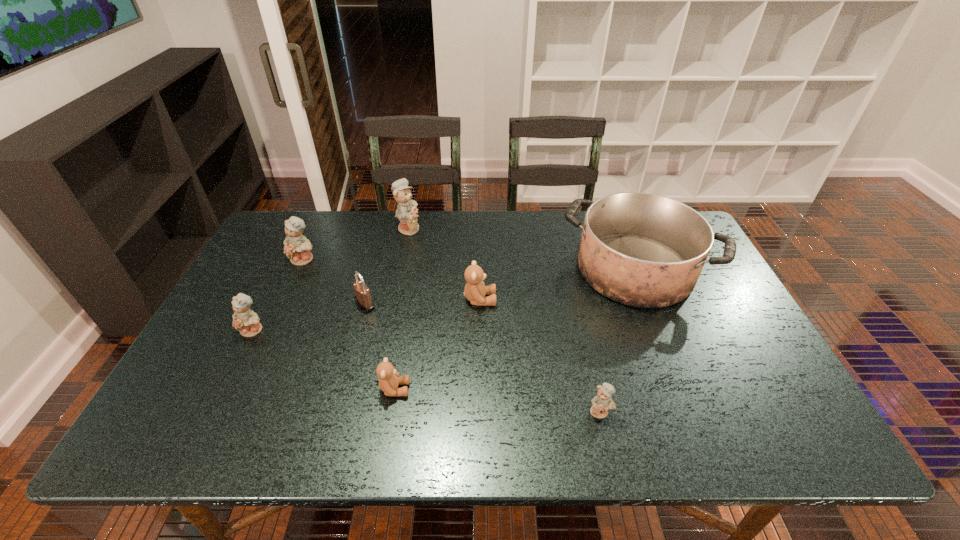
The width and height of the screenshot is (960, 540). I want to click on free space between the sixth object from right to left and the tallest teddy bear, so click(387, 266).

Where is `vacant area that lies between the fifth farthest teddy bear and the third smallest blue teddy bear`? The image size is (960, 540). vacant area that lies between the fifth farthest teddy bear and the third smallest blue teddy bear is located at coordinates (349, 325).

At what (x,y) coordinates should I click in order to perform the action: click on object that can be found as the seventh closest to the third nearest object. Please return your answer as a coordinate pair (x, y). Image resolution: width=960 pixels, height=540 pixels. Looking at the image, I should click on (601, 403).

Where is `the second closest object to the third biggest blue teddy bear`? This screenshot has width=960, height=540. the second closest object to the third biggest blue teddy bear is located at coordinates (297, 247).

This screenshot has height=540, width=960. In order to click on teddy bear that is the closest to the sixth object from right to left in this screenshot , I will do `click(297, 247)`.

Locate which teddy bear ranks fifth in proximity to the saucepan. Please provide its 2D coordinates. Your answer should be formatted as a tuple, i.e. [(x, y)], where the tuple contains the x and y coordinates of a point satisfying the conditions above.

[(297, 247)]

Locate which blue teddy bear is the second closest to the saucepan. Please provide its 2D coordinates. Your answer should be formatted as a tuple, i.e. [(x, y)], where the tuple contains the x and y coordinates of a point satisfying the conditions above.

[(406, 212)]

Choose which blue teddy bear is the third nearest neighbor to the fifth farthest teddy bear. Please provide its 2D coordinates. Your answer should be formatted as a tuple, i.e. [(x, y)], where the tuple contains the x and y coordinates of a point satisfying the conditions above.

[(297, 247)]

Where is `vacant area that satisfies the following two spatial constraints: 1. on the face of the farther brown teddy bear; 2. on the front-facing side of the fourth farthest teddy bear`? vacant area that satisfies the following two spatial constraints: 1. on the face of the farther brown teddy bear; 2. on the front-facing side of the fourth farthest teddy bear is located at coordinates (480, 330).

Where is `free point that satisfies the following two spatial constraints: 1. on the front side of the saucepan; 2. on the face of the bigger brown teddy bear`? This screenshot has width=960, height=540. free point that satisfies the following two spatial constraints: 1. on the front side of the saucepan; 2. on the face of the bigger brown teddy bear is located at coordinates (647, 300).